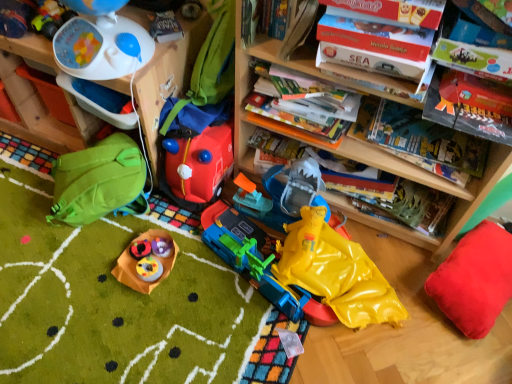
Image resolution: width=512 pixels, height=384 pixels. In order to click on rubberized red backpack at center, the sixth toy when ordered from left to right in this screenshot , I will do `click(196, 166)`.

Find the location of a particular element. matte cardboard box at upper right, positioned as the 1th book in front-to-back order is located at coordinates (396, 10).

Image resolution: width=512 pixels, height=384 pixels. What do you see at coordinates (140, 249) in the screenshot?
I see `rubberized plastic toy at center, the 3th toy when ordered from left to right` at bounding box center [140, 249].

What is the approximate width of matte plastic cupcakes at center, which appears as the 5th toy when viewed from the left?

The width of matte plastic cupcakes at center, which appears as the 5th toy when viewed from the left, is 9.61 inches.

The image size is (512, 384). What do you see at coordinates (426, 185) in the screenshot?
I see `wooden bookcase at upper center` at bounding box center [426, 185].

Locate an element on the screen. This screenshot has width=512, height=384. wooden bookcase at upper center is located at coordinates (426, 185).

I want to click on black cardboard book at upper right, the 3th book in the front-to-back sequence, so click(465, 116).

How distant is red cardboard box at upper right, arranged as the 2th book when viewed from the front, from red plush pillow at lower right?

red cardboard box at upper right, arranged as the 2th book when viewed from the front, is 31.75 inches from red plush pillow at lower right.

Which of these two, red cardboard box at upper right, the fifth book viewed from the back, or red plush pillow at lower right, stands shorter?

Standing shorter between the two is red cardboard box at upper right, the fifth book viewed from the back.

Looking at the image, does red cardboard box at upper right, the fifth book viewed from the back, seem bigger or smaller compared to red plush pillow at lower right?

Clearly, red cardboard box at upper right, the fifth book viewed from the back, is smaller in size than red plush pillow at lower right.

Is red cardboard box at upper right, arranged as the 2th book when viewed from the front, aimed at red plush pillow at lower right?

No, red cardboard box at upper right, arranged as the 2th book when viewed from the front, is not oriented towards red plush pillow at lower right.

Is point (456, 271) closer or farther from the camera than point (42, 41)?

Point (456, 271) appears to be farther away from the viewer than point (42, 41).

Between red plush pillow at lower right and wooden bookshelf at upper left, which one has smaller size?

With smaller size is red plush pillow at lower right.

In terms of height, does red plush pillow at lower right look taller or shorter compared to wooden bookshelf at upper left?

red plush pillow at lower right is shorter than wooden bookshelf at upper left.

Is red plush pillow at lower right completely or partially outside of wooden bookshelf at upper left?

That's correct, red plush pillow at lower right is outside of wooden bookshelf at upper left.

Could you measure the distance between rubberized plastic toy at center, which is the fourth toy in left-to-right order, and hardcover book at upper center, the third book viewed from the back?

They are 32.16 inches apart.

What are the coordinates of `book that is the 4th object above the rubberized plastic toy at center, positioned as the 4th toy in right-to-left order (from a real-world perspective)` in the screenshot? It's located at (266, 19).

From the image's perspective, between rubberized plastic toy at center, which is the fourth toy in left-to-right order, and hardcover book at upper center, the third book viewed from the back, which one is located above?

hardcover book at upper center, the third book viewed from the back.

Would you say rubberized plastic toy at center, positioned as the 4th toy in right-to-left order, contains hardcover book at upper center, the third book viewed from the back?

That's incorrect, hardcover book at upper center, the third book viewed from the back, is not inside rubberized plastic toy at center, positioned as the 4th toy in right-to-left order.

Is rubberized plastic toy at upper left, marked as the first toy in a left-to-right arrangement, oriented away from rubberized plastic toy at center, which is the fourth toy in left-to-right order?

That's not correct — rubberized plastic toy at upper left, marked as the first toy in a left-to-right arrangement, is not looking away from rubberized plastic toy at center, which is the fourth toy in left-to-right order.

Considering the positions of objects rubberized plastic toy at upper left, arranged as the 7th toy when viewed from the right, and rubberized plastic toy at center, which is the fourth toy in left-to-right order, in the image provided, who is more to the right, rubberized plastic toy at upper left, arranged as the 7th toy when viewed from the right, or rubberized plastic toy at center, which is the fourth toy in left-to-right order,?

rubberized plastic toy at center, which is the fourth toy in left-to-right order, is more to the right.

In terms of height, does rubberized plastic toy at upper left, arranged as the 7th toy when viewed from the right, look taller or shorter compared to rubberized plastic toy at center, positioned as the 4th toy in right-to-left order?

In the image, rubberized plastic toy at upper left, arranged as the 7th toy when viewed from the right, appears to be taller than rubberized plastic toy at center, positioned as the 4th toy in right-to-left order.

Could you measure the distance between matte cardboard box at upper right, the sixth book from the back, and rubberized plastic toy at center, positioned as the 4th toy in right-to-left order?

matte cardboard box at upper right, the sixth book from the back, and rubberized plastic toy at center, positioned as the 4th toy in right-to-left order, are 39.19 inches apart from each other.

Locate an element on the screen. The width and height of the screenshot is (512, 384). the 6th book in front of the rubberized plastic toy at center, which is the fourth toy in left-to-right order is located at coordinates (396, 10).

From the picture: Does matte cardboard box at upper right, positioned as the 1th book in front-to-back order, have a greater height compared to rubberized plastic toy at center, positioned as the 4th toy in right-to-left order?

Indeed, matte cardboard box at upper right, positioned as the 1th book in front-to-back order, has a greater height compared to rubberized plastic toy at center, positioned as the 4th toy in right-to-left order.

In the scene shown: Is there a large distance between matte cardboard box at upper right, positioned as the 1th book in front-to-back order, and rubberized plastic toy at center, which is the fourth toy in left-to-right order?

That's not correct — matte cardboard box at upper right, positioned as the 1th book in front-to-back order, is a little close to rubberized plastic toy at center, which is the fourth toy in left-to-right order.

From the picture: Between rubberized red backpack at center, the 2th toy from the right, and matte cardboard box at upper right, positioned as the 1th book in front-to-back order, which one has less height?

matte cardboard box at upper right, positioned as the 1th book in front-to-back order, is shorter.

Which object is positioned more to the left, rubberized red backpack at center, the sixth toy when ordered from left to right, or matte cardboard box at upper right, positioned as the 1th book in front-to-back order?

rubberized red backpack at center, the sixth toy when ordered from left to right.

Do you think rubberized red backpack at center, the sixth toy when ordered from left to right, is within matte cardboard box at upper right, the sixth book from the back, or outside of it?

rubberized red backpack at center, the sixth toy when ordered from left to right, exists outside the volume of matte cardboard box at upper right, the sixth book from the back.

Are rubberized red backpack at center, the sixth toy when ordered from left to right, and matte cardboard box at upper right, positioned as the 1th book in front-to-back order, far apart?

No, there isn't a large distance between rubberized red backpack at center, the sixth toy when ordered from left to right, and matte cardboard box at upper right, positioned as the 1th book in front-to-back order.

Between rubberized plastic toy at upper left, marked as the first toy in a left-to-right arrangement, and red plush pillow at lower right, which one has larger size?

Bigger between the two is red plush pillow at lower right.

Looking at this image, can you see rubberized plastic toy at upper left, marked as the first toy in a left-to-right arrangement, touching red plush pillow at lower right?

rubberized plastic toy at upper left, marked as the first toy in a left-to-right arrangement, and red plush pillow at lower right are clearly separated.

Identify the location of pillow below the rubberized plastic toy at upper left, marked as the first toy in a left-to-right arrangement (from the image's perspective). The width and height of the screenshot is (512, 384). (475, 279).

You are a GUI agent. You are given a task and a screenshot of the screen. Output one action in this format:
    pyautogui.click(x=<x>, y=<y>)
    Task: Click on the pillow that appears below the red cardboard box at upper right, the fifth book viewed from the back (from the image's perspective)
    
    Given the screenshot: What is the action you would take?
    pyautogui.click(x=475, y=279)

The width and height of the screenshot is (512, 384). What are the coordinates of `shelf lying above the red plush pillow at lower right (from the image's perspective)` in the screenshot? It's located at (40, 101).

Which object lies nearer to the anchor point wooden bookcase at upper center, rubberized plastic toy at upper left, arranged as the 7th toy when viewed from the right, or yellow rubber raincoat at lower center, which is counted as the first toy, starting from the right?

Based on the image, rubberized plastic toy at upper left, arranged as the 7th toy when viewed from the right, appears to be nearer to wooden bookcase at upper center.

Which object lies nearer to the anchor point green fabric backpack at lower left, red plush pillow at lower right or black cardboard book at upper right, marked as the fourth book in a back-to-front arrangement?

The object closer to green fabric backpack at lower left is black cardboard book at upper right, marked as the fourth book in a back-to-front arrangement.

Based on the photo, when comparing their distances from red cardboard box at upper right, arranged as the 2th book when viewed from the front, does black cardboard book at upper right, marked as the fourth book in a back-to-front arrangement, or matte plastic cupcakes at center, which ranks as the third toy in right-to-left order, seem further?

Among the two, matte plastic cupcakes at center, which ranks as the third toy in right-to-left order, is located further to red cardboard box at upper right, arranged as the 2th book when viewed from the front.

Estimate the real-world distances between objects in this image. Which object is further from rubberized red backpack at center, the 2th toy from the right, matte plastic cupcakes at center, which appears as the 5th toy when viewed from the left, or matte cardboard box at upper right, the sixth book from the back?

Based on the image, matte cardboard box at upper right, the sixth book from the back, appears to be further to rubberized red backpack at center, the 2th toy from the right.

Based on their spatial positions, is wooden bookshelf at upper left or black cardboard book at upper right, marked as the fourth book in a back-to-front arrangement, closer to rubberized plastic toy at center, which is the fourth toy in left-to-right order?

Based on the image, wooden bookshelf at upper left appears to be nearer to rubberized plastic toy at center, which is the fourth toy in left-to-right order.

Considering their positions, is rubberized plastic toy at center, positioned as the 4th toy in right-to-left order, positioned closer to hardcover book at upper center, which is the 5th book in front-to-back order, than matte plastic cupcakes at center, which appears as the 5th toy when viewed from the left?

Among the two, matte plastic cupcakes at center, which appears as the 5th toy when viewed from the left, is located nearer to hardcover book at upper center, which is the 5th book in front-to-back order.

Estimate the real-world distances between objects in this image. Which object is further from rubberized red backpack at center, the 2th toy from the right, black cardboard book at upper right, the 3th book in the front-to-back sequence, or rubberized plastic toy at center, positioned as the 4th toy in right-to-left order?

black cardboard book at upper right, the 3th book in the front-to-back sequence, is further to rubberized red backpack at center, the 2th toy from the right.

Looking at the image, which one is located further to white plastic toy at upper left, the 2th toy viewed from the left, hardcover book at center, marked as the 6th book in a front-to-back arrangement, or rubberized plastic toy at center, positioned as the 4th toy in right-to-left order?

Based on the image, hardcover book at center, marked as the 6th book in a front-to-back arrangement, appears to be further to white plastic toy at upper left, the 2th toy viewed from the left.

Locate an element on the screen. The height and width of the screenshot is (384, 512). shelf that lies between hardcover book at upper center, the third book viewed from the back, and rubberized plastic toy at center, the 3th toy when ordered from left to right, from top to bottom is located at coordinates (40, 101).

You are a GUI agent. You are given a task and a screenshot of the screen. Output one action in this format:
    pyautogui.click(x=<x>, y=<y>)
    Task: Click on the toy that lies between green fabric backpack at lower left and matte plastic cupcakes at center, which appears as the 5th toy when viewed from the left, from top to bottom
    
    Given the screenshot: What is the action you would take?
    pyautogui.click(x=140, y=249)

Where is `backpack between wooden bookshelf at upper left and yellow rubber raincoat at lower center, which ranks as the seventh toy in left-to-right order, in the horizontal direction`? The width and height of the screenshot is (512, 384). backpack between wooden bookshelf at upper left and yellow rubber raincoat at lower center, which ranks as the seventh toy in left-to-right order, in the horizontal direction is located at coordinates (99, 182).

Find the location of `toy situated between rubberized red backpack at center, the 2th toy from the right, and hardcover book at upper center, which is the 5th book in front-to-back order, from left to right`. toy situated between rubberized red backpack at center, the 2th toy from the right, and hardcover book at upper center, which is the 5th book in front-to-back order, from left to right is located at coordinates (333, 273).